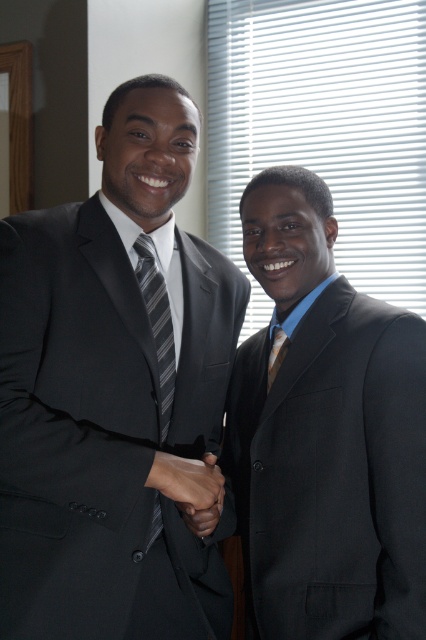
Question: Does matte black suit at left have a lesser width compared to striped fabric tie at center?

Choices:
 (A) yes
 (B) no

Answer: (B)

Question: Is matte black suit at left closer to the viewer compared to striped fabric tie at center?

Choices:
 (A) yes
 (B) no

Answer: (A)

Question: Which point is farther from the camera taking this photo?

Choices:
 (A) (253, 442)
 (B) (221, 593)

Answer: (B)

Question: Which of the following is the closest to the observer?

Choices:
 (A) (143, 273)
 (B) (282, 342)

Answer: (A)

Question: Can you confirm if matte black suit at left is smaller than matte black suit at right?

Choices:
 (A) no
 (B) yes

Answer: (A)

Question: Which of the following is the closest to the observer?

Choices:
 (A) (167, 369)
 (B) (279, 365)

Answer: (A)